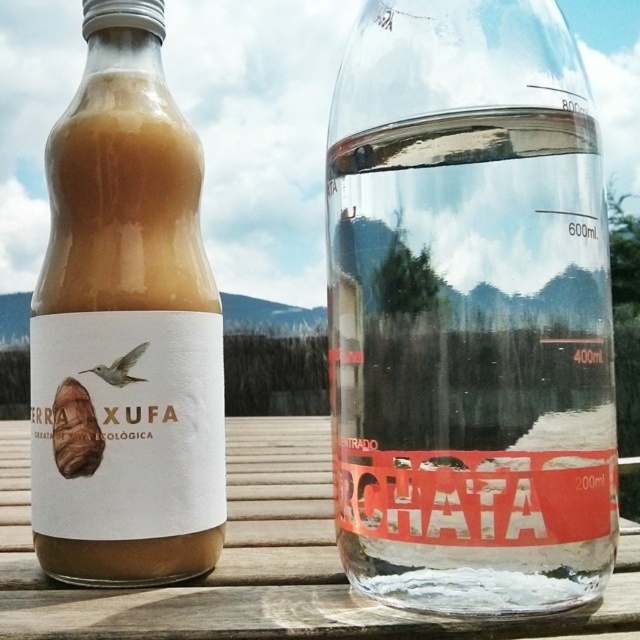
You are a delivery person who needs to place a third bottle between the transparent glass bottle at center and the matte glass bottle at left. The new bottle is 3 inches wide. Can it fit in the space between them?

The distance between the transparent glass bottle at center and the matte glass bottle at left is 4.67 inches. Since the new bottle is 3 inches wide, there is enough space to place it between them.